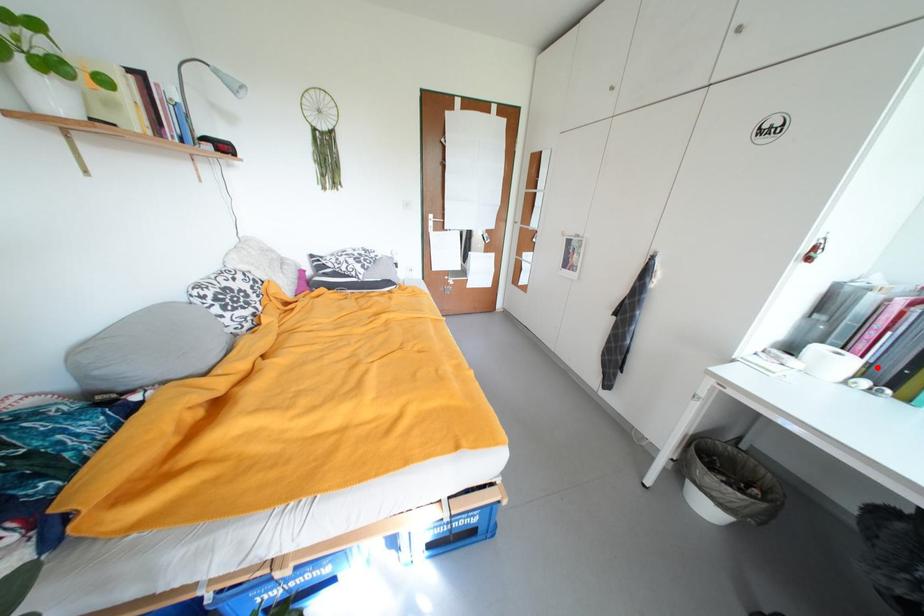
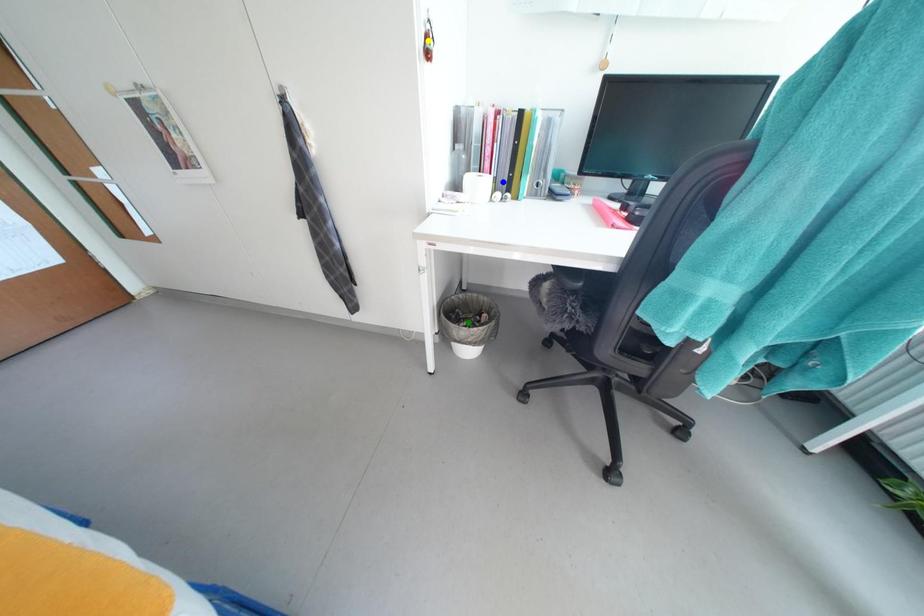
Question: I am providing you with two images of the same scene from different viewpoints. A red point is marked on the first image. You are given multiple points on the second image. Which point in image 2 is actually the same real-world point as the red point in image 1?

Choices:
 (A) blue point
 (B) yellow point
 (C) green point

Answer: (A)